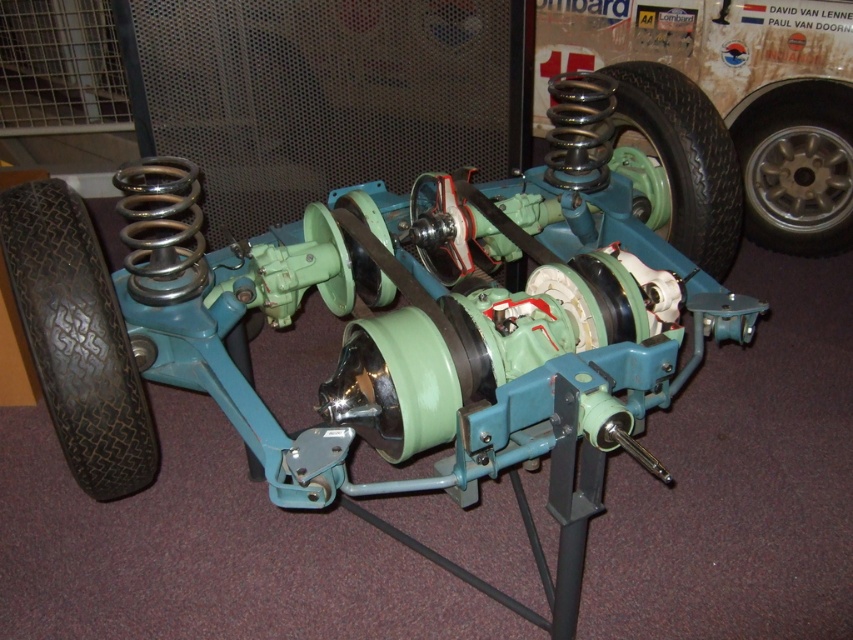
You are an engineer inspecting the mechanical assembly. You notice the metallic silver wheel at right and the black rubber tire at center. Which object is closer to you from your viewpoint?

The metallic silver wheel at right is closer to you because the black rubber tire at center is positioned behind it.

You are an engineer examining the mechanical assembly. You need to attach a sensor to the object that is positioned to the right of the other. Which object should you choose between the black rubber tire at lower left and the metallic silver wheel at right?

The metallic silver wheel at right is positioned to the right of the black rubber tire at lower left, so you should choose the metallic silver wheel at right to attach the sensor.

You are an engineer inspecting the mechanical assembly. You need to access both the black rubber tire at lower left and the metallic silver wheel at right. Which one would you need to move first to reach the other?

The black rubber tire at lower left is closer to the viewer than the metallic silver wheel at right. To reach the metallic silver wheel at right, you would need to move the black rubber tire at lower left first.